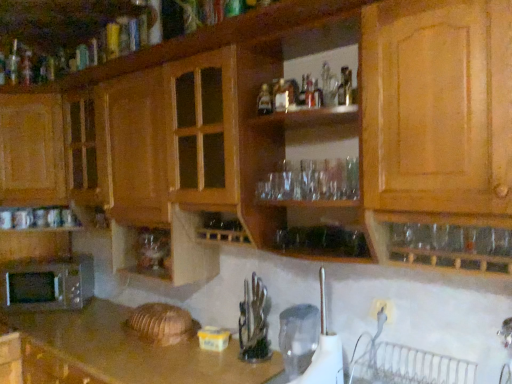
You are a GUI agent. You are given a task and a screenshot of the screen. Output one action in this format:
    pyautogui.click(x=<x>, y=<y>)
    Task: Click on the wooden cutting board at lower left
    This screenshot has width=512, height=384.
    Given the screenshot: What is the action you would take?
    pyautogui.click(x=133, y=349)

What is the approximate height of clear glass bottle at upper center, which is the 1th bottle from right to left?

clear glass bottle at upper center, which is the 1th bottle from right to left, is 4.74 inches in height.

Locate an element on the screen. The height and width of the screenshot is (384, 512). clear glass bottle at upper center, which appears as the first bottle when viewed from the front is located at coordinates (345, 87).

This screenshot has height=384, width=512. Describe the element at coordinates (298, 337) in the screenshot. I see `transparent plastic pitcher at lower center, arranged as the 1th appliance when viewed from the back` at that location.

How much space does transparent plastic pitcher at lower center, which is the second appliance from front to back, occupy vertically?

transparent plastic pitcher at lower center, which is the second appliance from front to back, is 26.29 centimeters in height.

At what (x,y) coordinates should I click in order to perform the action: click on silver metallic microwave at lower left. Please return your answer as a coordinate pair (x, y). This screenshot has width=512, height=384. Looking at the image, I should click on (49, 283).

Locate an element on the screen. This screenshot has width=512, height=384. white plastic kettle at lower center, which is counted as the 1th appliance, starting from the front is located at coordinates (324, 351).

Measure the distance between point (x=11, y=83) and camera.

They are 7.39 feet apart.

The image size is (512, 384). In order to click on wooden cutting board at lower left in this screenshot , I will do `click(133, 349)`.

Is clear glass bottle at upper center, which is the 1th bottle from right to left, positioned beyond the bounds of wooden cabinet at upper center, arranged as the 1th cabinetry when viewed from the top?

clear glass bottle at upper center, which is the 1th bottle from right to left, is positioned outside wooden cabinet at upper center, arranged as the 1th cabinetry when viewed from the top.

Which is behind, clear glass bottle at upper center, which is counted as the 2th bottle, starting from the left, or wooden cabinet at upper center, arranged as the 3th cabinetry when ordered from the bottom?

clear glass bottle at upper center, which is counted as the 2th bottle, starting from the left.

Is clear glass bottle at upper center, which is the 1th bottle from right to left, looking in the opposite direction of wooden cabinet at upper center, arranged as the 3th cabinetry when ordered from the bottom?

That's not correct — clear glass bottle at upper center, which is the 1th bottle from right to left, is not looking away from wooden cabinet at upper center, arranged as the 3th cabinetry when ordered from the bottom.

From the image's perspective, which object appears higher, clear glass bottle at upper center, which appears as the first bottle when viewed from the front, or wooden cabinet at upper center, arranged as the 3th cabinetry when ordered from the bottom?

From the image's view, wooden cabinet at upper center, arranged as the 3th cabinetry when ordered from the bottom, is above.

Is wooden cutting board at lower left further to the viewer compared to silver metallic microwave at lower left?

No, wooden cutting board at lower left is closer to the camera.

Can you tell me how much wooden cutting board at lower left and silver metallic microwave at lower left differ in facing direction?

They differ by 47.7 degrees in their facing directions.

Considering the relative positions of wooden cutting board at lower left and silver metallic microwave at lower left in the image provided, is wooden cutting board at lower left to the left or to the right of silver metallic microwave at lower left?

Based on their positions, wooden cutting board at lower left is located to the right of silver metallic microwave at lower left.

From the picture: Is wooden cutting board at lower left oriented towards silver metallic microwave at lower left?

No.

Considering the positions of objects wooden cabinet at left, which ranks as the 2th cabinetry in bottom-to-top order, and wooden cabinet at center, the 3th cabinetry viewed from the top, in the image provided, who is behind, wooden cabinet at left, which ranks as the 2th cabinetry in bottom-to-top order, or wooden cabinet at center, the 3th cabinetry viewed from the top,?

wooden cabinet at left, which ranks as the 2th cabinetry in bottom-to-top order, is more distant.

Between wooden cabinet at left, which ranks as the 2th cabinetry in bottom-to-top order, and wooden cabinet at center, the 3th cabinetry viewed from the top, which one has smaller size?

Smaller between the two is wooden cabinet at left, which ranks as the 2th cabinetry in bottom-to-top order.

Which object is thinner, wooden cabinet at left, the 2th cabinetry in the top-to-bottom sequence, or wooden cabinet at center, which is counted as the 1th cabinetry, starting from the bottom?

wooden cabinet at left, the 2th cabinetry in the top-to-bottom sequence, is thinner.

Is wooden cabinet at upper center, arranged as the 1th cabinetry when viewed from the top, turned away from transparent plastic pitcher at lower center, arranged as the 1th appliance when viewed from the back?

wooden cabinet at upper center, arranged as the 1th cabinetry when viewed from the top, is not turned away from transparent plastic pitcher at lower center, arranged as the 1th appliance when viewed from the back.

Is the position of wooden cabinet at upper center, arranged as the 3th cabinetry when ordered from the bottom, more distant than that of transparent plastic pitcher at lower center, which is the second appliance from front to back?

That is False.

Looking at this image, is wooden cabinet at upper center, arranged as the 3th cabinetry when ordered from the bottom, inside or outside of transparent plastic pitcher at lower center, arranged as the 1th appliance when viewed from the back?

wooden cabinet at upper center, arranged as the 3th cabinetry when ordered from the bottom, is located beyond the bounds of transparent plastic pitcher at lower center, arranged as the 1th appliance when viewed from the back.

Considering the relative positions of wooden cabinet at center, the 3th cabinetry viewed from the top, and wooden cabinet at left, which ranks as the 2th cabinetry in bottom-to-top order, in the image provided, is wooden cabinet at center, the 3th cabinetry viewed from the top, to the left of wooden cabinet at left, which ranks as the 2th cabinetry in bottom-to-top order, from the viewer's perspective?

In fact, wooden cabinet at center, the 3th cabinetry viewed from the top, is to the right of wooden cabinet at left, which ranks as the 2th cabinetry in bottom-to-top order.

In the scene shown: Considering their positions, is wooden cabinet at center, the 3th cabinetry viewed from the top, located in front of or behind wooden cabinet at left, which ranks as the 2th cabinetry in bottom-to-top order?

wooden cabinet at center, the 3th cabinetry viewed from the top, is in front of wooden cabinet at left, which ranks as the 2th cabinetry in bottom-to-top order.

Does wooden cabinet at center, which is counted as the 1th cabinetry, starting from the bottom, have a larger size compared to wooden cabinet at left, which ranks as the 2th cabinetry in bottom-to-top order?

Indeed, wooden cabinet at center, which is counted as the 1th cabinetry, starting from the bottom, has a larger size compared to wooden cabinet at left, which ranks as the 2th cabinetry in bottom-to-top order.

Is wooden cabinet at center, which is counted as the 1th cabinetry, starting from the bottom, looking in the opposite direction of wooden cabinet at left, which ranks as the 2th cabinetry in bottom-to-top order?

Yes.

Is wooden cutting board at lower left facing towards white plastic kettle at lower center, which is counted as the 1th appliance, starting from the front?

No.

Which object is wider, wooden cutting board at lower left or white plastic kettle at lower center, which is counted as the 1th appliance, starting from the front?

Wider between the two is wooden cutting board at lower left.

Is wooden cutting board at lower left positioned behind white plastic kettle at lower center, which is counted as the 1th appliance, starting from the front?

No, the depth of wooden cutting board at lower left is less than that of white plastic kettle at lower center, which is counted as the 1th appliance, starting from the front.

From the image's perspective, which one is positioned lower, wooden cutting board at lower left or white plastic kettle at lower center, which is the second appliance in back-to-front order?

wooden cutting board at lower left is shown below in the image.

Can you tell me how much wooden cabinet at left, which ranks as the 2th cabinetry in bottom-to-top order, and clear glass bottle at upper center, placed as the second bottle when sorted from back to front, differ in facing direction?

The angular difference between wooden cabinet at left, which ranks as the 2th cabinetry in bottom-to-top order, and clear glass bottle at upper center, placed as the second bottle when sorted from back to front, is 43 degrees.

Which is in front, point (9, 194) or point (344, 95)?

Positioned in front is point (344, 95).

Does wooden cabinet at left, which ranks as the 2th cabinetry in bottom-to-top order, turn towards clear glass bottle at upper center, placed as the second bottle when sorted from back to front?

No, wooden cabinet at left, which ranks as the 2th cabinetry in bottom-to-top order, does not turn towards clear glass bottle at upper center, placed as the second bottle when sorted from back to front.

Which cabinetry is the 2nd one when counting from the left side of the clear glass bottle at upper center, placed as the second bottle when sorted from back to front? Please provide its 2D coordinates.

[(64, 56)]

Where is `microwave oven above the wooden cutting board at lower left (from the image's perspective)`? This screenshot has width=512, height=384. microwave oven above the wooden cutting board at lower left (from the image's perspective) is located at coordinates (49, 283).

Considering their positions, is wooden cabinet at left, which ranks as the 2th cabinetry in bottom-to-top order, positioned further to clear glass bottle at upper center, which is the 1th bottle from right to left, than white plastic kettle at lower center, which is counted as the 1th appliance, starting from the front?

The object further to clear glass bottle at upper center, which is the 1th bottle from right to left, is wooden cabinet at left, which ranks as the 2th cabinetry in bottom-to-top order.

When comparing their distances from clear glass bottle at upper center, which appears as the first bottle when viewed from the front, does transparent plastic pitcher at lower center, which is the second appliance from front to back, or wooden cabinet at left, which ranks as the 2th cabinetry in bottom-to-top order, seem closer?

transparent plastic pitcher at lower center, which is the second appliance from front to back.

Estimate the real-world distances between objects in this image. Which object is further from wooden cutting board at lower left, silver metallic microwave at lower left or transparent plastic pitcher at lower center, which is the second appliance from front to back?

transparent plastic pitcher at lower center, which is the second appliance from front to back.

Based on their spatial positions, is clear glass bottle at upper center, which appears as the first bottle when viewed from the front, or white plastic kettle at lower center, which is the second appliance in back-to-front order, further from wooden cabinet at left, the 2th cabinetry in the top-to-bottom sequence?

Based on the image, clear glass bottle at upper center, which appears as the first bottle when viewed from the front, appears to be further to wooden cabinet at left, the 2th cabinetry in the top-to-bottom sequence.

When comparing their distances from translucent glass bottle at upper center, the 1th bottle in the back-to-front sequence, does white plastic kettle at lower center, which is the second appliance in back-to-front order, or clear glass bottle at upper center, which is counted as the 2th bottle, starting from the left, seem further?

white plastic kettle at lower center, which is the second appliance in back-to-front order.

When comparing their distances from transparent plastic pitcher at lower center, which is the second appliance from front to back, does white plastic kettle at lower center, which is counted as the 1th appliance, starting from the front, or wooden cutting board at lower left seem further?

wooden cutting board at lower left.

In the scene shown: Which object lies further to the anchor point clear glass bottle at upper center, which appears as the first bottle when viewed from the front, transparent plastic pitcher at lower center, arranged as the 1th appliance when viewed from the back, or wooden cabinet at center, the 3th cabinetry viewed from the top?

transparent plastic pitcher at lower center, arranged as the 1th appliance when viewed from the back, is positioned further to the anchor clear glass bottle at upper center, which appears as the first bottle when viewed from the front.

From the image, which object appears to be nearer to clear glass bottle at upper center, which is the 1th bottle from right to left, white plastic kettle at lower center, which is the second appliance in back-to-front order, or translucent glass bottle at upper center, the 2th bottle viewed from the right?

Among the two, translucent glass bottle at upper center, the 2th bottle viewed from the right, is located nearer to clear glass bottle at upper center, which is the 1th bottle from right to left.

Locate an element on the screen. The height and width of the screenshot is (384, 512). appliance between silver metallic microwave at lower left and white plastic kettle at lower center, which is the second appliance in back-to-front order is located at coordinates (298, 337).

Image resolution: width=512 pixels, height=384 pixels. In order to click on bottle between translucent glass bottle at upper center, the 1th bottle in the back-to-front sequence, and wooden cutting board at lower left vertically in this screenshot , I will do `click(345, 87)`.

Where is `countertop positioned between wooden cabinet at upper center, arranged as the 3th cabinetry when ordered from the bottom, and wooden cabinet at left, which ranks as the 2th cabinetry in bottom-to-top order, from near to far`? This screenshot has width=512, height=384. countertop positioned between wooden cabinet at upper center, arranged as the 3th cabinetry when ordered from the bottom, and wooden cabinet at left, which ranks as the 2th cabinetry in bottom-to-top order, from near to far is located at coordinates (133, 349).

I want to click on bottle between wooden cabinet at center, the 3th cabinetry viewed from the top, and transparent plastic pitcher at lower center, arranged as the 1th appliance when viewed from the back, in the front-back direction, so click(345, 87).